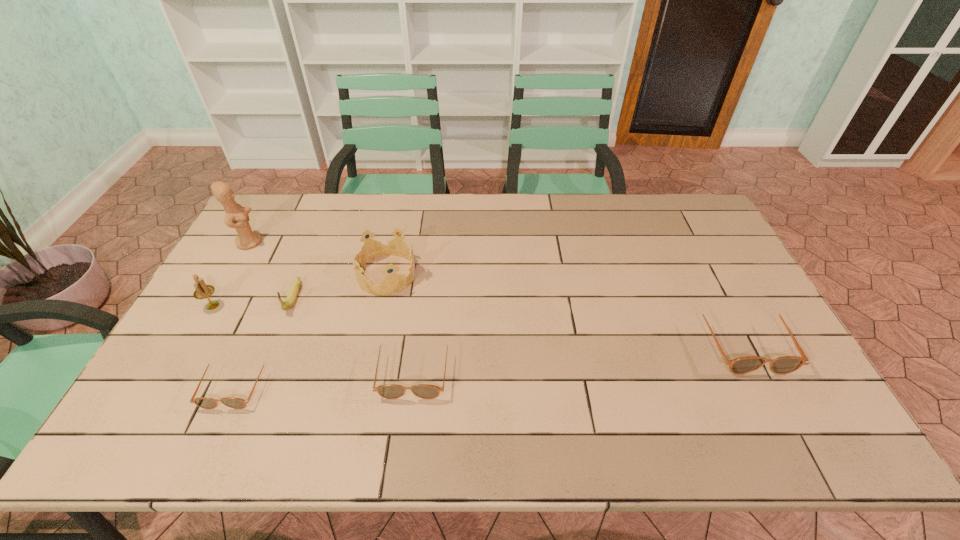
Select which object appears as the fourth closest to the banana. Please provide its 2D coordinates. Your answer should be formatted as a tuple, i.e. [(x, y)], where the tuple contains the x and y coordinates of a point satisfying the conditions above.

[(237, 217)]

You are a GUI agent. You are given a task and a screenshot of the screen. Output one action in this format:
    pyautogui.click(x=<x>, y=<y>)
    Task: Click on the closest object to the rightmost sunglasses
    This screenshot has height=540, width=960.
    Given the screenshot: What is the action you would take?
    pyautogui.click(x=389, y=391)

You are a GUI agent. You are given a task and a screenshot of the screen. Output one action in this format:
    pyautogui.click(x=<x>, y=<y>)
    Task: Click on the sunglasses that is the second nearest to the tiara
    The width and height of the screenshot is (960, 540).
    Given the screenshot: What is the action you would take?
    pyautogui.click(x=203, y=402)

Identify which sunglasses is located as the second nearest to the tiara. Please provide its 2D coordinates. Your answer should be formatted as a tuple, i.e. [(x, y)], where the tuple contains the x and y coordinates of a point satisfying the conditions above.

[(203, 402)]

In order to click on vacant area in the image that satisfies the following two spatial constraints: 1. on the front-facing side of the figurine; 2. on the front side of the candle holder in this screenshot , I will do `click(213, 306)`.

This screenshot has height=540, width=960. Find the location of `vacant region that satisfies the following two spatial constraints: 1. on the front-facing side of the tiara; 2. on the front-facing side of the leftmost sunglasses`. vacant region that satisfies the following two spatial constraints: 1. on the front-facing side of the tiara; 2. on the front-facing side of the leftmost sunglasses is located at coordinates (363, 384).